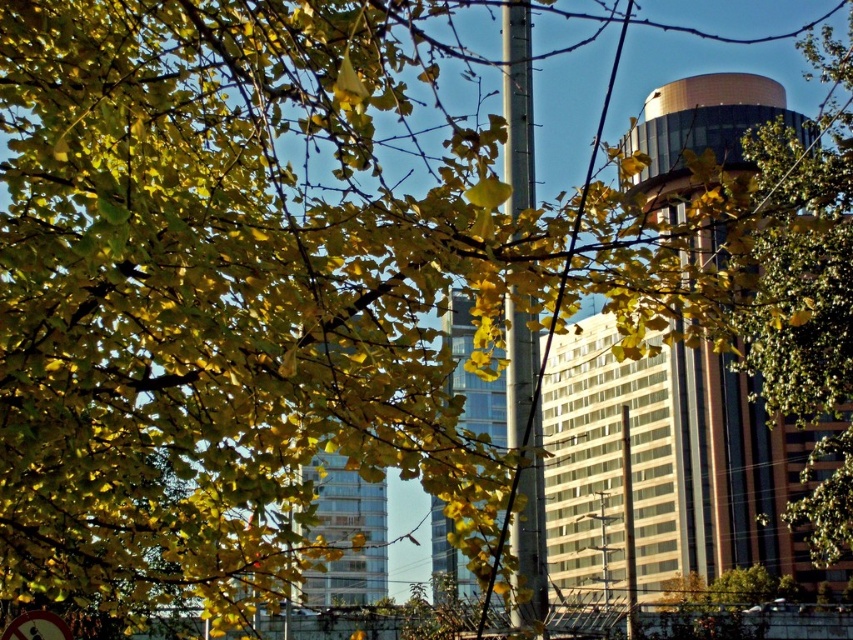
Based on the photo, who is more distant from viewer, (x=724, y=84) or (x=65, y=628)?

The point (x=724, y=84) is more distant.

Can you confirm if gold reflective tower at upper right is positioned to the right of red plastic circle at lower left?

Correct, you'll find gold reflective tower at upper right to the right of red plastic circle at lower left.

The image size is (853, 640). I want to click on gold reflective tower at upper right, so click(x=737, y=472).

Based on the photo, is gold reflective tower at upper right to the right of glassy reflective skyscraper at center from the viewer's perspective?

Correct, you'll find gold reflective tower at upper right to the right of glassy reflective skyscraper at center.

Does point (680, 508) come in front of point (451, 358)?

No, it is not.

Between point (698, 152) and point (444, 337), which one is positioned behind?

Point (698, 152)

Identify the location of gold reflective tower at upper right. (737, 472).

Which is more to the right, glassy reflective skyscraper at center or red plastic circle at lower left?

glassy reflective skyscraper at center is more to the right.

Which is below, glassy reflective skyscraper at center or red plastic circle at lower left?

red plastic circle at lower left

Image resolution: width=853 pixels, height=640 pixels. I want to click on glassy reflective skyscraper at center, so click(x=473, y=372).

You are a GUI agent. You are given a task and a screenshot of the screen. Output one action in this format:
    pyautogui.click(x=<x>, y=<y>)
    Task: Click on the glassy reflective skyscraper at center
    The width and height of the screenshot is (853, 640).
    Given the screenshot: What is the action you would take?
    473,372